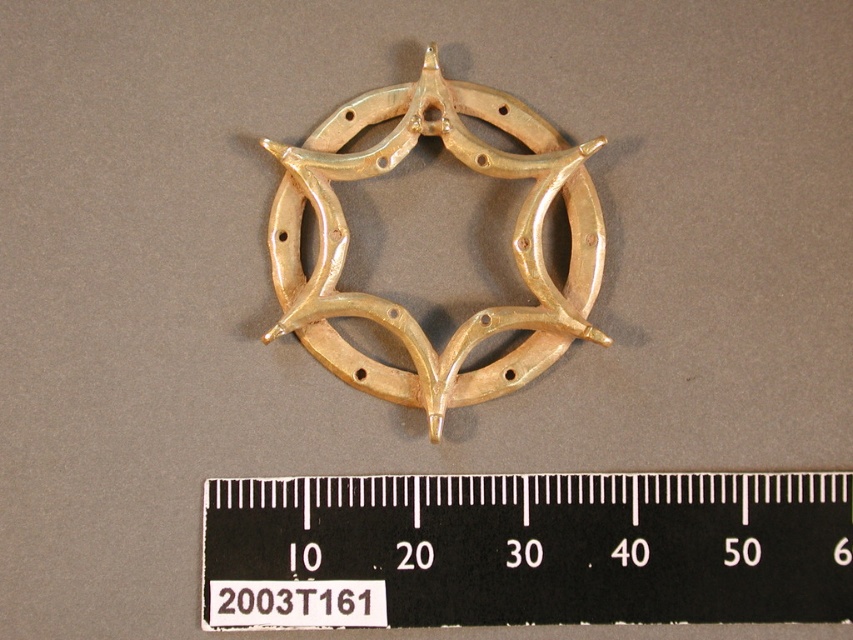
Question: Does black plastic ruler at center have a smaller size compared to gold metallic horseshoe at center?

Choices:
 (A) yes
 (B) no

Answer: (A)

Question: Which point is farther from the camera taking this photo?

Choices:
 (A) (587, 282)
 (B) (524, 616)

Answer: (A)

Question: Does black plastic ruler at center appear on the right side of gold metallic horseshoe at center?

Choices:
 (A) yes
 (B) no

Answer: (A)

Question: Does black plastic ruler at center have a lesser width compared to gold metallic horseshoe at center?

Choices:
 (A) yes
 (B) no

Answer: (B)